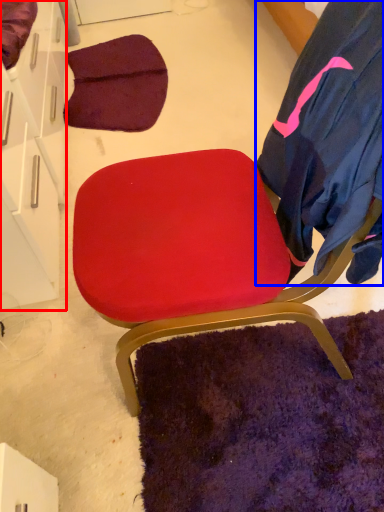
Question: Which point is further to the camera, drawer (highlighted by a red box) or robe (highlighted by a blue box)?

Choices:
 (A) drawer
 (B) robe

Answer: (A)